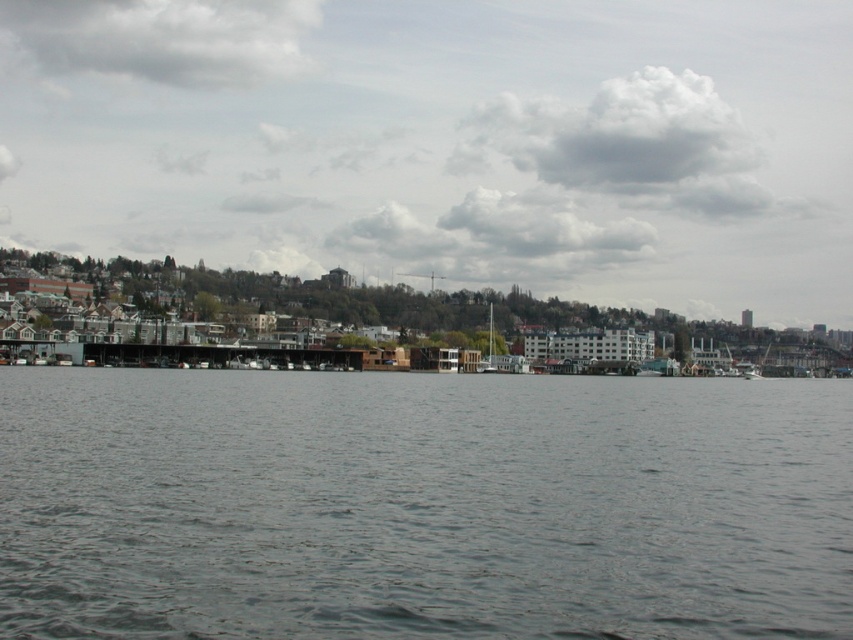
You are standing on the shore looking at the gray water at center and the white plastic boat at center. Which object is closer to you?

The white plastic boat at center is closer to you because it is positioned over the gray water at center, which is beneath it.

You are a photographer planning to capture the waterfront scene. The gray water at center is crucial for the reflection in your shot. To ensure the reflection is centered in your photo, where should you position your camera? Specify coordinates based on the image grid where the top left corner is the origin point.

The gray water at center is located at coordinates point (421, 506), so you should position your camera to center the shot at those coordinates to capture the reflection properly.